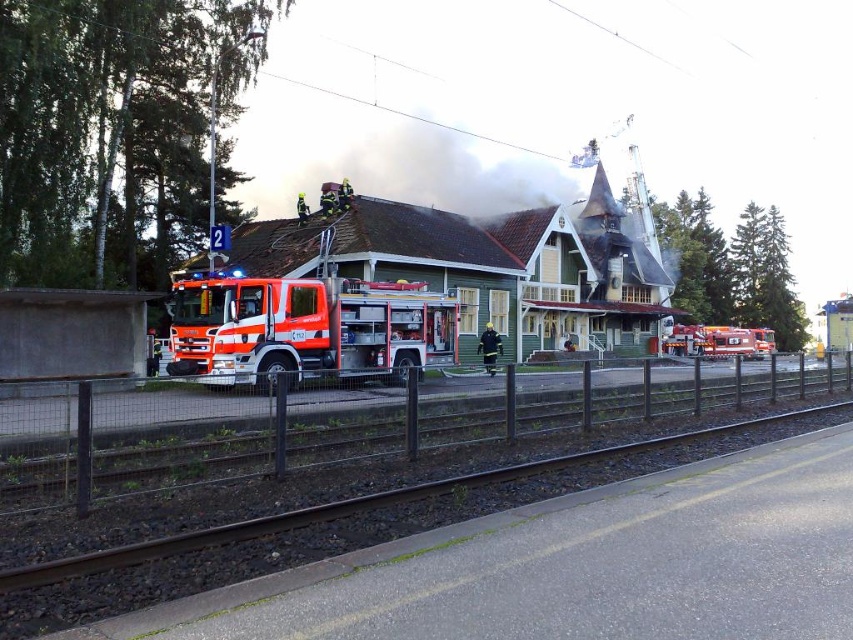
You are a firefighter trying to enter the green wooden railway station at center to rescue people. There is a black uniform fireman at center blocking your path. Can you pass through him?

The green wooden railway station at center is larger than the black uniform fireman at center, but the fireman is a person and can move out of the way if needed. You should communicate with them to find a safe path forward.

You are a firefighter arriving at the scene and need to access the building. There is a metal fence at lower center and an orange glossy fire truck at center. Which object is bigger in size?

The metal fence at lower center is larger in size than the orange glossy fire truck at center.